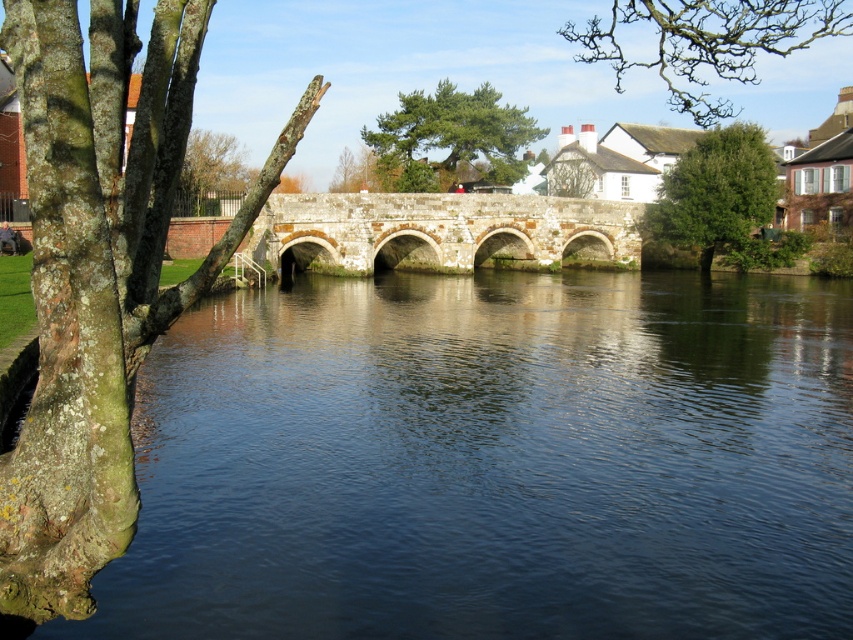
Question: Which is nearer to the bare branches at upper center?

Choices:
 (A) stone arch bridge at center
 (B) green leafy tree at center
 (C) green lichen-covered tree trunk at left

Answer: (B)

Question: Is dark blue water at center in front of green lichen-covered tree trunk at left?

Choices:
 (A) yes
 (B) no

Answer: (B)

Question: In this image, where is dark blue water at center located relative to green leafy tree at right?

Choices:
 (A) left
 (B) right

Answer: (A)

Question: Which of the following is the closest to the observer?

Choices:
 (A) green lichen-covered tree trunk at left
 (B) green leafy tree at right
 (C) stone arch bridge at center

Answer: (A)

Question: Does green lichen-covered tree trunk at left lie behind green leafy tree at center?

Choices:
 (A) yes
 (B) no

Answer: (B)

Question: Which of the following is the farthest from the observer?

Choices:
 (A) (426, 220)
 (B) (733, 145)

Answer: (B)